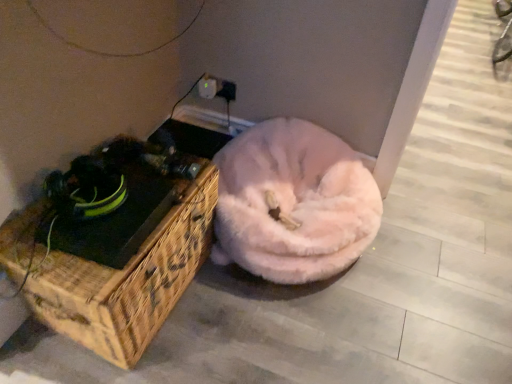
Question: From a real-world perspective, is fuzzy pink dog bed at center physically located above or below woven wood chest at left?

Choices:
 (A) above
 (B) below

Answer: (B)

Question: Is point (316, 203) positioned closer to the camera than point (8, 244)?

Choices:
 (A) farther
 (B) closer

Answer: (A)

Question: Estimate the real-world distances between objects in this image. Which object is closer to the woven wood chest at left?

Choices:
 (A) white plastic electric outlet at upper center
 (B) fuzzy pink dog bed at center

Answer: (B)

Question: Considering the real-world distances, which object is farthest from the woven wood chest at left?

Choices:
 (A) white plastic electric outlet at upper center
 (B) fuzzy pink dog bed at center

Answer: (A)